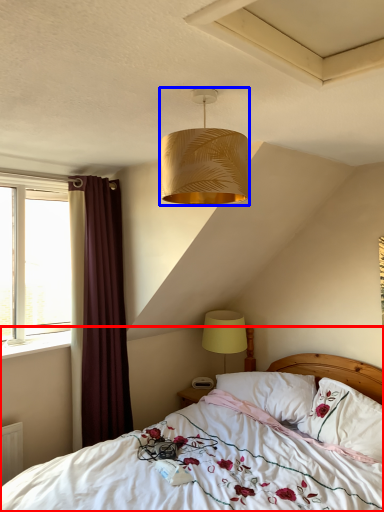
Question: Which object appears farthest to the camera in this image, bed (highlighted by a red box) or lamp (highlighted by a blue box)?

Choices:
 (A) bed
 (B) lamp

Answer: (B)